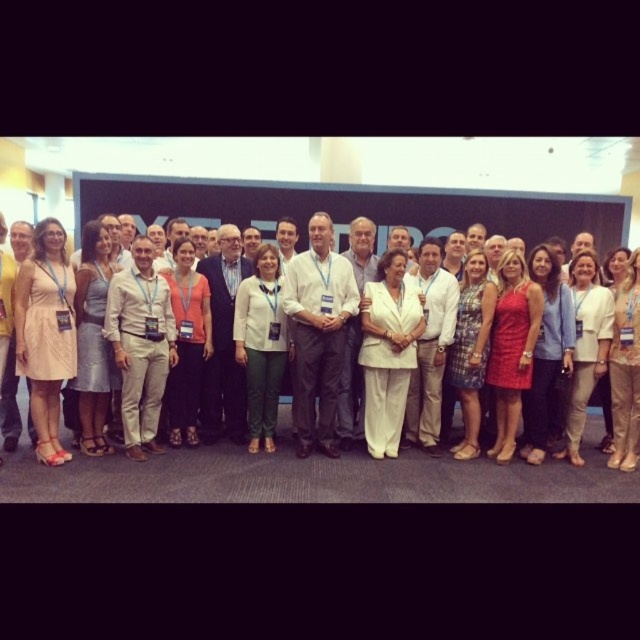
Question: Is white cotton dress at center below white fabric suit at center?

Choices:
 (A) no
 (B) yes

Answer: (B)

Question: Which of the following is the farthest from the observer?

Choices:
 (A) tap(316, 356)
 (B) tap(154, 362)

Answer: (A)

Question: Can you confirm if white cotton dress at center is positioned to the right of white fabric suit at center?

Choices:
 (A) no
 (B) yes

Answer: (A)

Question: Where is white cotton dress at center located in relation to white fabric suit at center in the image?

Choices:
 (A) below
 (B) above

Answer: (A)

Question: Which of the following is the farthest from the observer?

Choices:
 (A) (108, 246)
 (B) (336, 259)

Answer: (B)